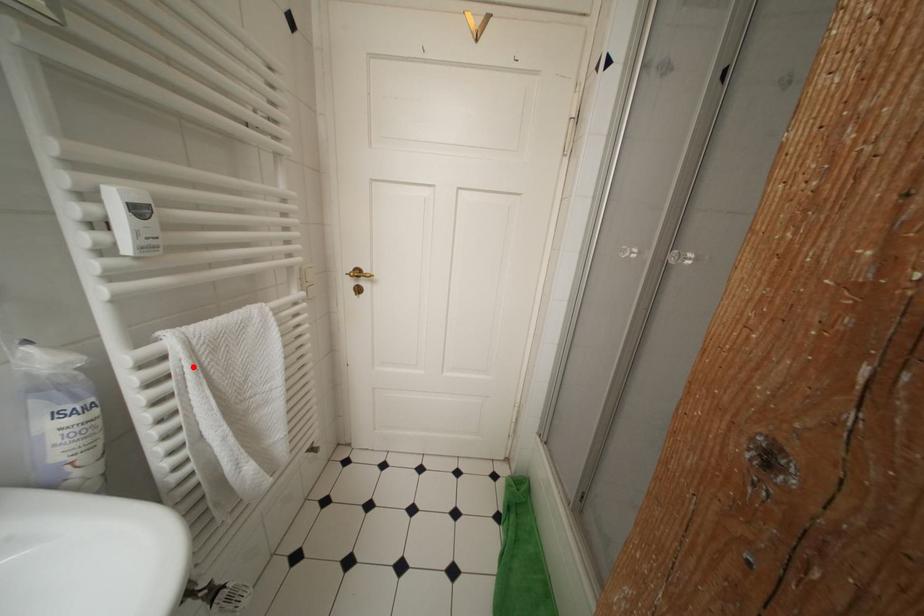
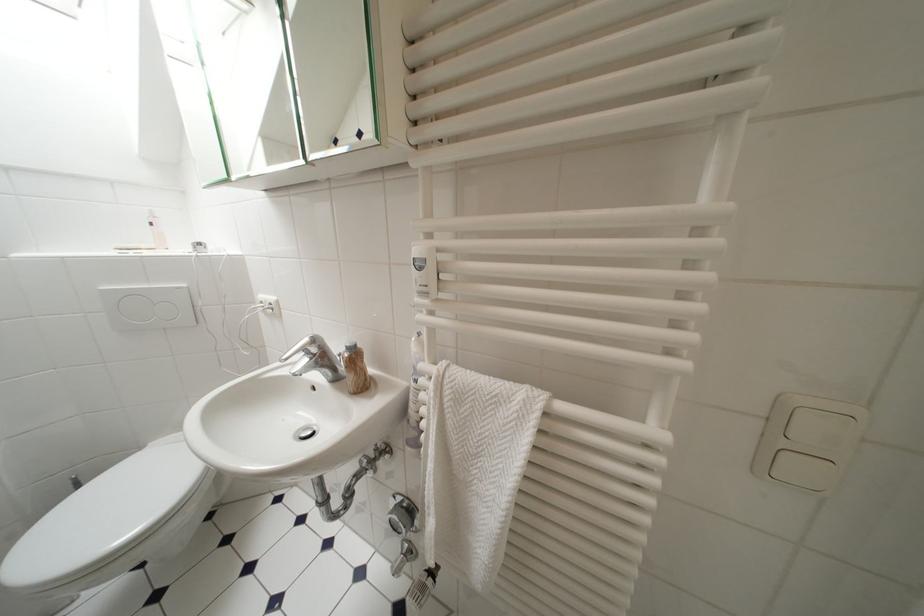
Locate, in the second image, the point that corresponds to the highlighted location in the first image.

(439, 397)